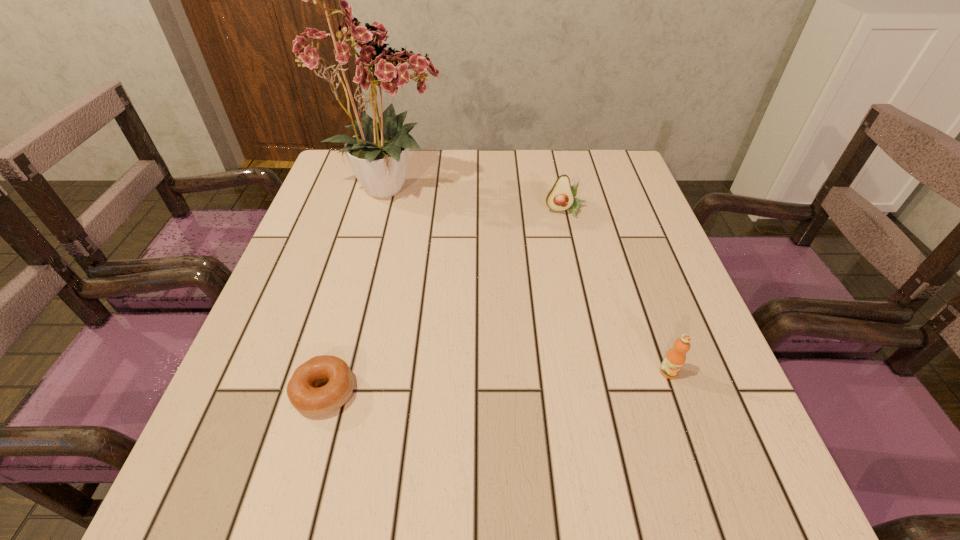
You are a GUI agent. You are given a task and a screenshot of the screen. Output one action in this format:
    pyautogui.click(x=<x>, y=<y>)
    Task: Click on the bagel located at the left edge
    The image size is (960, 540).
    Given the screenshot: What is the action you would take?
    pyautogui.click(x=302, y=389)

You are a GUI agent. You are given a task and a screenshot of the screen. Output one action in this format:
    pyautogui.click(x=<x>, y=<y>)
    Task: Click on the avocado located in the right edge section of the desktop
    The height and width of the screenshot is (540, 960).
    Given the screenshot: What is the action you would take?
    pyautogui.click(x=561, y=197)

Find the location of a particular element. The image size is (960, 540). orange juice located at the right edge is located at coordinates (675, 358).

Where is `object located at the far left corner`? object located at the far left corner is located at coordinates (378, 154).

In the image, there is a desktop. At what (x,y) coordinates should I click in order to perform the action: click on vacant space at the far edge. Please return your answer as a coordinate pair (x, y). Looking at the image, I should click on (533, 195).

Where is `vacant space at the near edge of the desktop`? This screenshot has height=540, width=960. vacant space at the near edge of the desktop is located at coordinates (612, 508).

Locate an element on the screen. vacant region at the left edge of the desktop is located at coordinates (310, 251).

Where is `vacant area at the right edge of the desktop`? The image size is (960, 540). vacant area at the right edge of the desktop is located at coordinates (631, 199).

At what (x,y) coordinates should I click in order to perform the action: click on free space at the near left corner of the desktop. Please return your answer as a coordinate pair (x, y). Image resolution: width=960 pixels, height=540 pixels. Looking at the image, I should click on (258, 497).

The width and height of the screenshot is (960, 540). In the image, there is a desktop. Identify the location of free space at the far right corner. (582, 184).